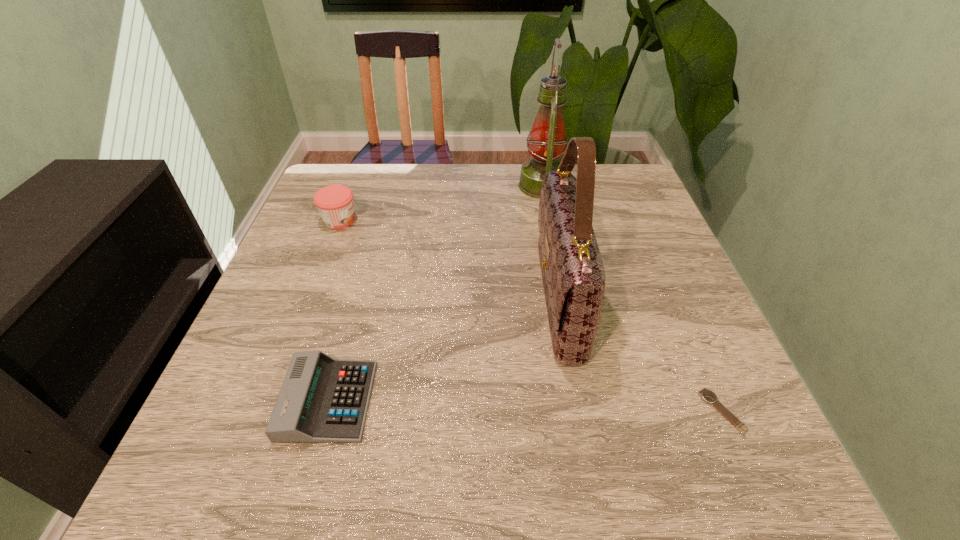
The width and height of the screenshot is (960, 540). I want to click on the farthest object, so click(547, 142).

The width and height of the screenshot is (960, 540). I want to click on handbag, so click(x=573, y=274).

Where is `the third shortest object`? The image size is (960, 540). the third shortest object is located at coordinates (335, 204).

Locate an element on the screen. jam is located at coordinates (335, 204).

In order to click on calculator in this screenshot , I will do `click(322, 400)`.

Locate an element on the screen. The image size is (960, 540). watch is located at coordinates (707, 395).

The width and height of the screenshot is (960, 540). I want to click on the shortest object, so click(707, 395).

Identify the location of vacant region located 0.130m on the front of the oil lamp. (551, 234).

Identify the location of vacant position located 0.320m on the front of the handbag with the clasp. This screenshot has width=960, height=540. (388, 299).

I want to click on blank space located on the front of the handbag with the clasp, so click(x=500, y=299).